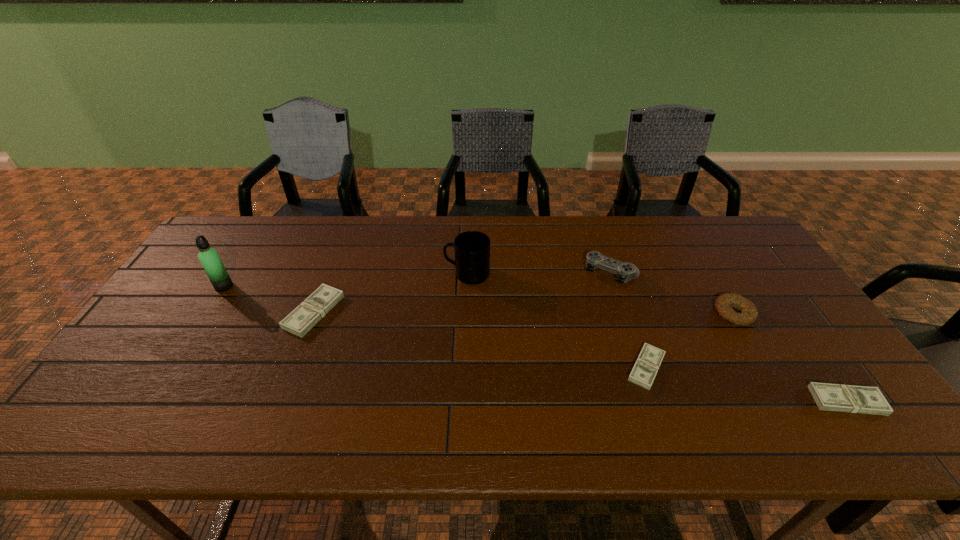
You are a GUI agent. You are given a task and a screenshot of the screen. Output one action in this format:
    pyautogui.click(x=<x>, y=<y>)
    Task: Click on the leftmost object
    The image size is (960, 540).
    Given the screenshot: What is the action you would take?
    pyautogui.click(x=209, y=257)

The image size is (960, 540). I want to click on the tallest object, so click(x=209, y=257).

Locate an element on the screen. control is located at coordinates (625, 271).

Where is `blank area located 0.280m on the right of the farthest money`? This screenshot has width=960, height=540. blank area located 0.280m on the right of the farthest money is located at coordinates (439, 312).

Where is `blank space located 0.230m on the right of the shortest object`? blank space located 0.230m on the right of the shortest object is located at coordinates (761, 368).

Identify the location of free spot located 0.250m on the left of the sixth tallest object. (707, 401).

I want to click on free space located 0.150m on the side of the mug with the handle, so click(396, 274).

You are a GUI agent. You are given a task and a screenshot of the screen. Output one action in this format:
    pyautogui.click(x=<x>, y=<y>)
    Task: Click on the free space located 0.130m on the side of the mug with the handle
    Image resolution: width=960 pixels, height=540 pixels.
    Given the screenshot: What is the action you would take?
    pyautogui.click(x=403, y=274)

This screenshot has width=960, height=540. In order to click on free spot located 0.280m on the side of the mug with the handle in this screenshot , I will do `click(354, 274)`.

Locate an element on the screen. The width and height of the screenshot is (960, 540). vacant space located 0.140m on the back of the sixth object from left to right is located at coordinates (708, 267).